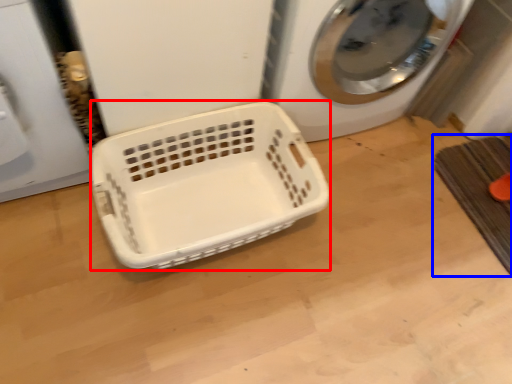
Question: Which of the following is the farthest to the observer, basket (highlighted by a red box) or bath mat (highlighted by a blue box)?

Choices:
 (A) basket
 (B) bath mat

Answer: (B)